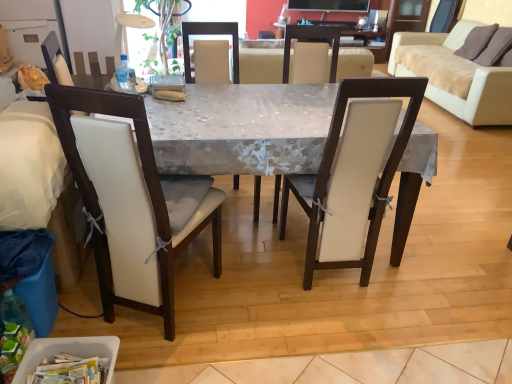
I want to click on vacant area located to the right-hand side of white leather chair at left, which is the 4th chair from right to left, so click(x=260, y=329).